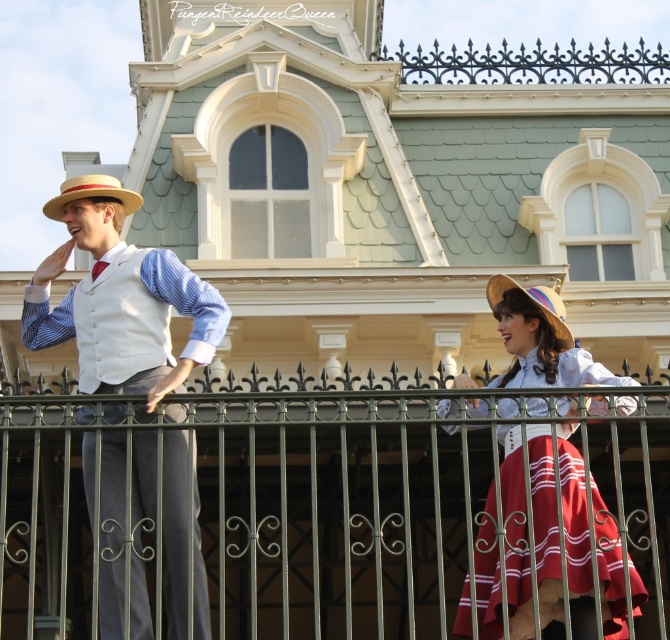
You are a photographer trying to capture a photo of the matte white vest at left and the matte red skirt at center. Which object is located more to the left side of the image?

The matte white vest at left is more to the left side of the image than the matte red skirt at center.

You are a photographer positioned in front of the Victorian building. You want to take a photo focusing on the matte red skirt at center and the natural straw hat at center. Which object should you adjust your camera focus on first if you want to ensure both are in focus?

The matte red skirt at center is closer to the viewer than the natural straw hat at center, so you should focus on the matte red skirt at center first to ensure both are in focus.